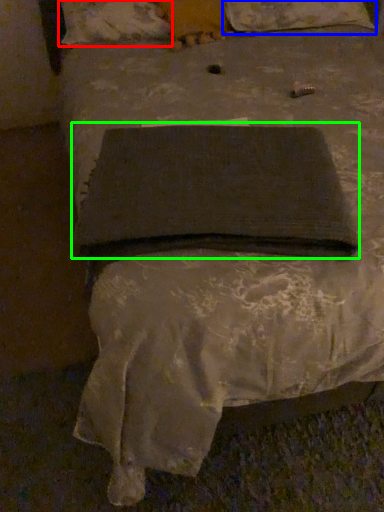
Question: Based on their relative distances, which object is nearer to pillow (highlighted by a red box)? Choose from pillow (highlighted by a blue box) and pad (highlighted by a green box).

Choices:
 (A) pillow
 (B) pad

Answer: (A)